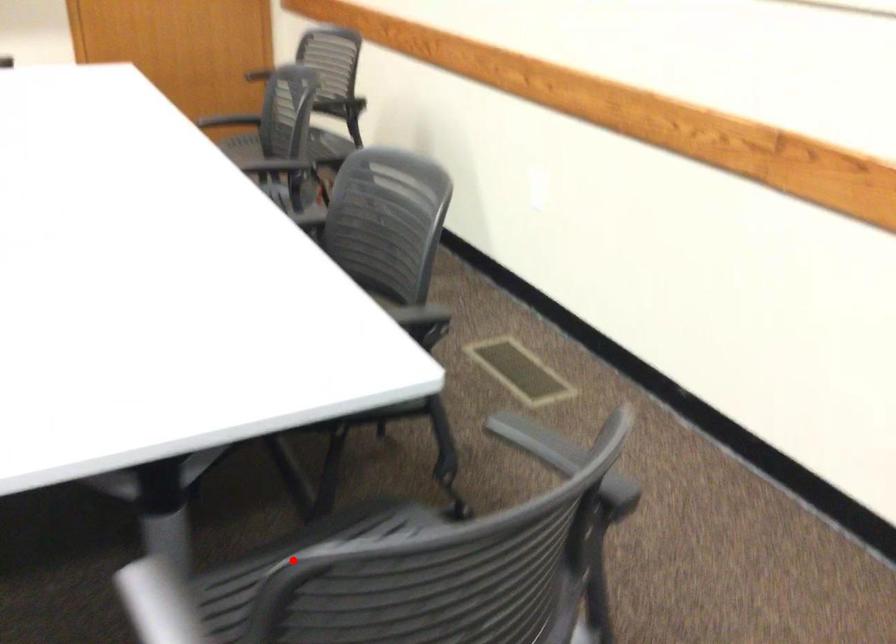
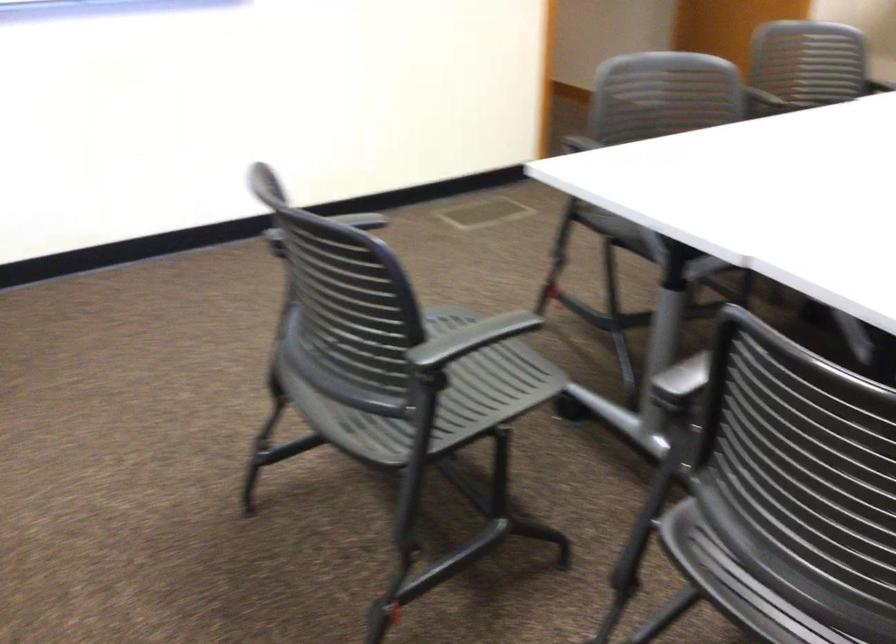
Question: I am providing you with two images of the same scene from different viewpoints. A red point is marked on the first image. Is the red point's position out of view in image 2?

Choices:
 (A) Yes
 (B) No

Answer: (A)